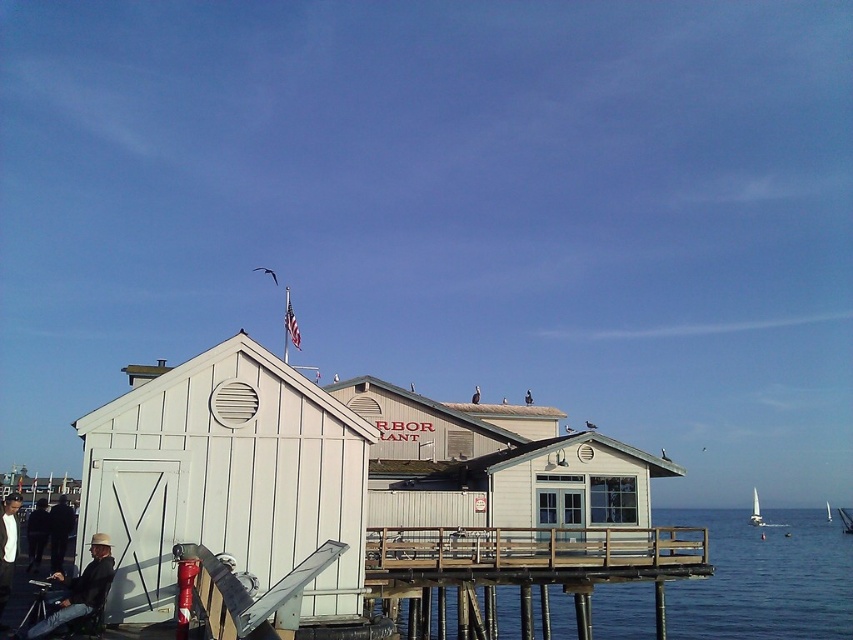
Question: Which of the following is the closest to the observer?

Choices:
 (A) (105, 547)
 (B) (753, 493)

Answer: (A)

Question: Is denim jacket at lower left behind dark gray jacket at lower left?

Choices:
 (A) yes
 (B) no

Answer: (B)

Question: Which point is farther to the camera?

Choices:
 (A) white sailboat at upper right
 (B) transparent blue water at lower center
 (C) white wood beach hut at left

Answer: (A)

Question: Is denim jacket at lower left bigger than white leather jacket at lower left?

Choices:
 (A) no
 (B) yes

Answer: (A)

Question: Which of the following is the closest to the observer?

Choices:
 (A) white sailboat at upper right
 (B) white wood beach hut at left
 (C) dark gray jacket at lower left

Answer: (B)

Question: Where is transparent blue water at lower center located in relation to white leather jacket at lower left in the image?

Choices:
 (A) above
 (B) below

Answer: (B)